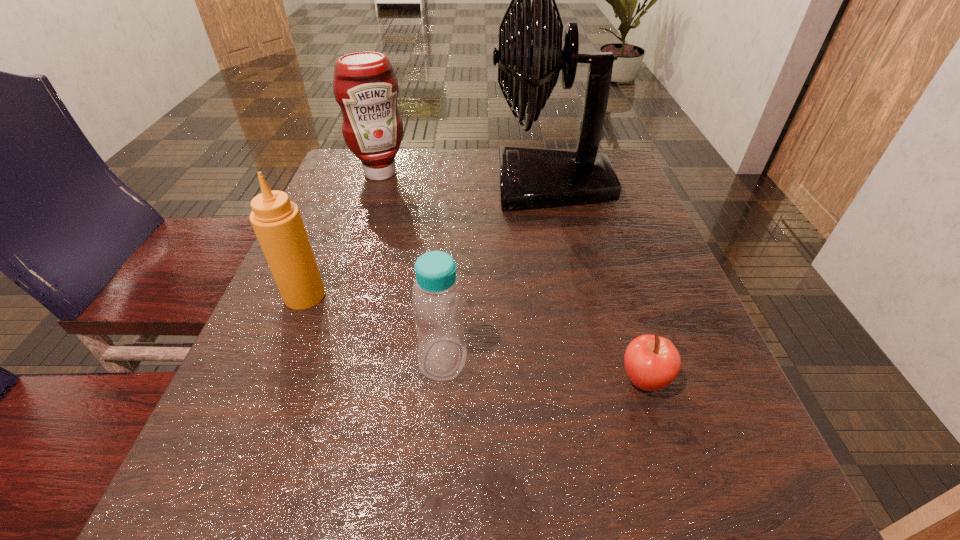
Image resolution: width=960 pixels, height=540 pixels. Identify the location of free spot between the farther condiment and the apple. (513, 276).

Where is `vacant area that lies between the fan and the apple`? This screenshot has width=960, height=540. vacant area that lies between the fan and the apple is located at coordinates (597, 282).

Identify the location of empty location between the third farthest object and the shortest object. This screenshot has width=960, height=540. (474, 338).

In order to click on unoccupied position between the third farthest object and the bottle in this screenshot , I will do `click(374, 327)`.

You are a GUI agent. You are given a task and a screenshot of the screen. Output one action in this format:
    pyautogui.click(x=<x>, y=<y>)
    Task: Click on the object that can be found as the second closest to the shortest object
    This screenshot has height=540, width=960.
    Given the screenshot: What is the action you would take?
    pyautogui.click(x=530, y=56)

Identify which object is the fourth nearest to the farther condiment. Please provide its 2D coordinates. Your answer should be formatted as a tuple, i.e. [(x, y)], where the tuple contains the x and y coordinates of a point satisfying the conditions above.

[(652, 362)]

Where is `vacant region that satisfies the following two spatial constraints: 1. in front of the tallest object to blow air; 2. on the right side of the shortest object`? vacant region that satisfies the following two spatial constraints: 1. in front of the tallest object to blow air; 2. on the right side of the shortest object is located at coordinates (594, 380).

The width and height of the screenshot is (960, 540). What are the coordinates of `vacant space that satisfies the following two spatial constraints: 1. in front of the fan to blow air; 2. on the back side of the apple` in the screenshot? It's located at (594, 380).

This screenshot has width=960, height=540. I want to click on vacant point that satisfies the following two spatial constraints: 1. on the front side of the shortest object; 2. on the right side of the nearer condiment, so click(270, 380).